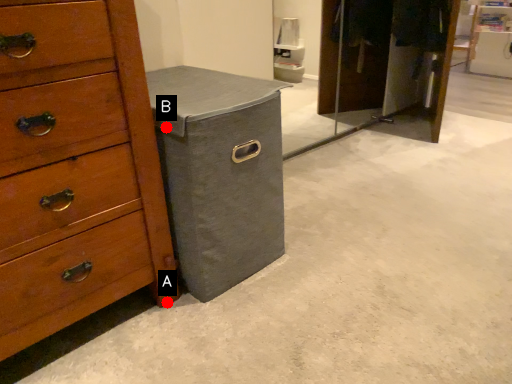
Question: Two points are circled on the image, labeled by A and B beside each circle. Which point appears closest to the camera in this image?

Choices:
 (A) A is closer
 (B) B is closer

Answer: (B)